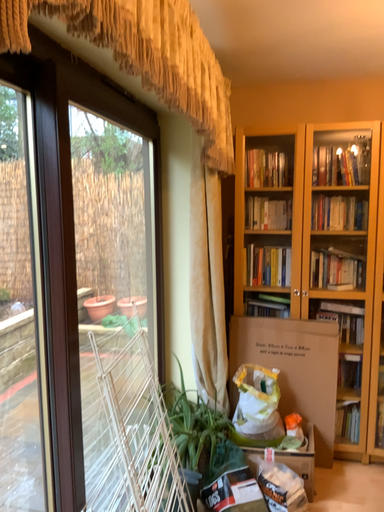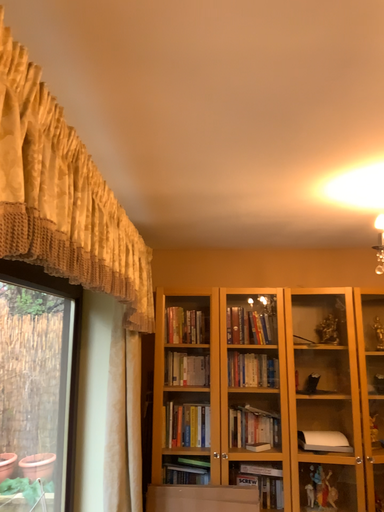
Question: Which way did the camera rotate in the video?

Choices:
 (A) rotated upward
 (B) rotated downward

Answer: (A)